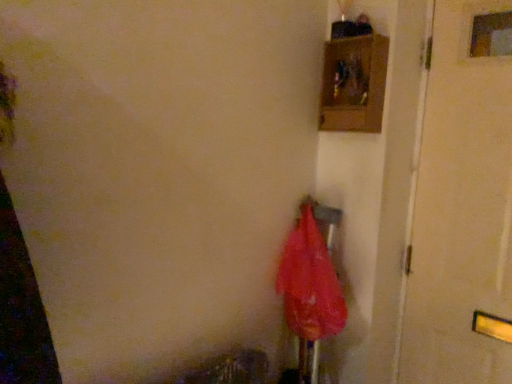
Question: Which is correct: white matte door at right is inside translucent red umbrella at center, or outside of it?

Choices:
 (A) outside
 (B) inside

Answer: (A)

Question: Visually, is white matte door at right positioned to the left or to the right of translucent red umbrella at center?

Choices:
 (A) left
 (B) right

Answer: (B)

Question: In terms of size, does white matte door at right appear bigger or smaller than translucent red umbrella at center?

Choices:
 (A) big
 (B) small

Answer: (A)

Question: Do you think translucent red umbrella at center is within white matte door at right, or outside of it?

Choices:
 (A) inside
 (B) outside

Answer: (B)

Question: Considering the positions of translucent red umbrella at center and white matte door at right in the image, is translucent red umbrella at center taller or shorter than white matte door at right?

Choices:
 (A) short
 (B) tall

Answer: (A)

Question: Looking at the image, does translucent red umbrella at center seem bigger or smaller compared to white matte door at right?

Choices:
 (A) big
 (B) small

Answer: (B)

Question: From a real-world perspective, is translucent red umbrella at center positioned above or below white matte door at right?

Choices:
 (A) above
 (B) below

Answer: (B)